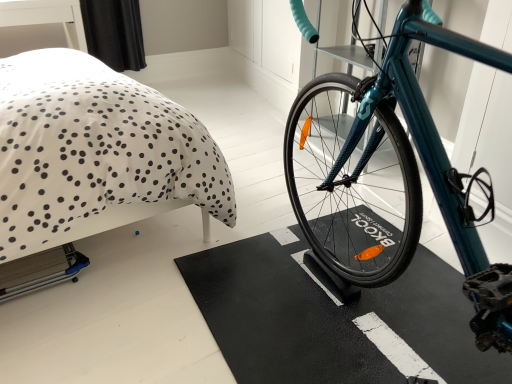
Question: From the image's perspective, is black rubber bath mat at center beneath white dotted fabric at upper left?

Choices:
 (A) yes
 (B) no

Answer: (A)

Question: From the image's perspective, is black rubber bath mat at center on white dotted fabric at upper left?

Choices:
 (A) yes
 (B) no

Answer: (B)

Question: Is black rubber bath mat at center positioned before white dotted fabric at upper left?

Choices:
 (A) yes
 (B) no

Answer: (B)

Question: Would you say black rubber bath mat at center contains white dotted fabric at upper left?

Choices:
 (A) yes
 (B) no

Answer: (B)

Question: Can you confirm if black rubber bath mat at center is positioned to the left of white dotted fabric at upper left?

Choices:
 (A) yes
 (B) no

Answer: (B)

Question: Can you confirm if black rubber bath mat at center is shorter than white dotted fabric at upper left?

Choices:
 (A) no
 (B) yes

Answer: (B)

Question: Is black rubber bath mat at center next to teal glossy bicycle at center and touching it?

Choices:
 (A) yes
 (B) no

Answer: (B)

Question: From a real-world perspective, is black rubber bath mat at center physically above teal glossy bicycle at center?

Choices:
 (A) no
 (B) yes

Answer: (A)

Question: Is black rubber bath mat at center thinner than teal glossy bicycle at center?

Choices:
 (A) no
 (B) yes

Answer: (B)

Question: Is teal glossy bicycle at center completely or partially inside black rubber bath mat at center?

Choices:
 (A) no
 (B) yes

Answer: (A)

Question: Can you confirm if black rubber bath mat at center is positioned to the left of teal glossy bicycle at center?

Choices:
 (A) yes
 (B) no

Answer: (A)

Question: Is black rubber bath mat at center positioned with its back to teal glossy bicycle at center?

Choices:
 (A) yes
 (B) no

Answer: (B)

Question: From a real-world perspective, is white dotted fabric at upper left below black rubber bath mat at center?

Choices:
 (A) yes
 (B) no

Answer: (B)